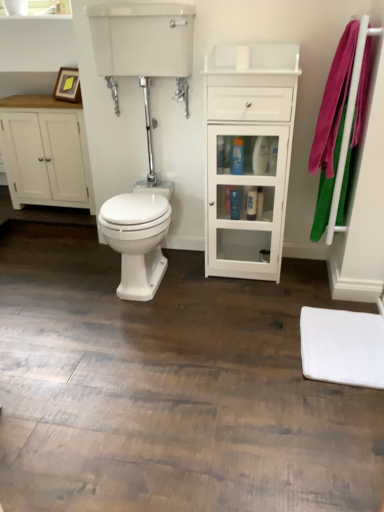
Where is `vacant space situated on the left part of wooden picture frame at upper left`? vacant space situated on the left part of wooden picture frame at upper left is located at coordinates (43, 101).